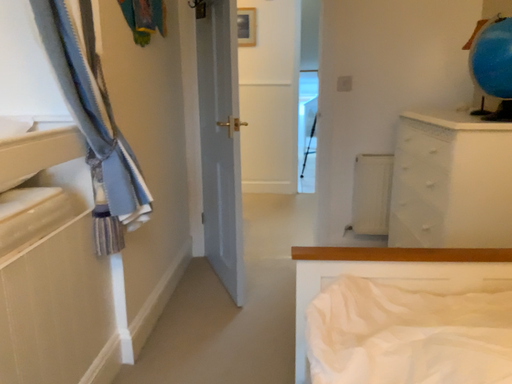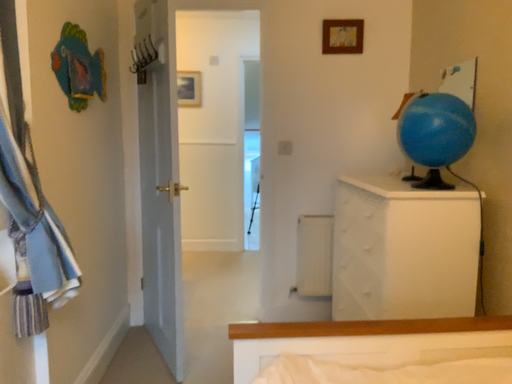
Question: Which way did the camera rotate in the video?

Choices:
 (A) rotated downward
 (B) rotated upward

Answer: (B)